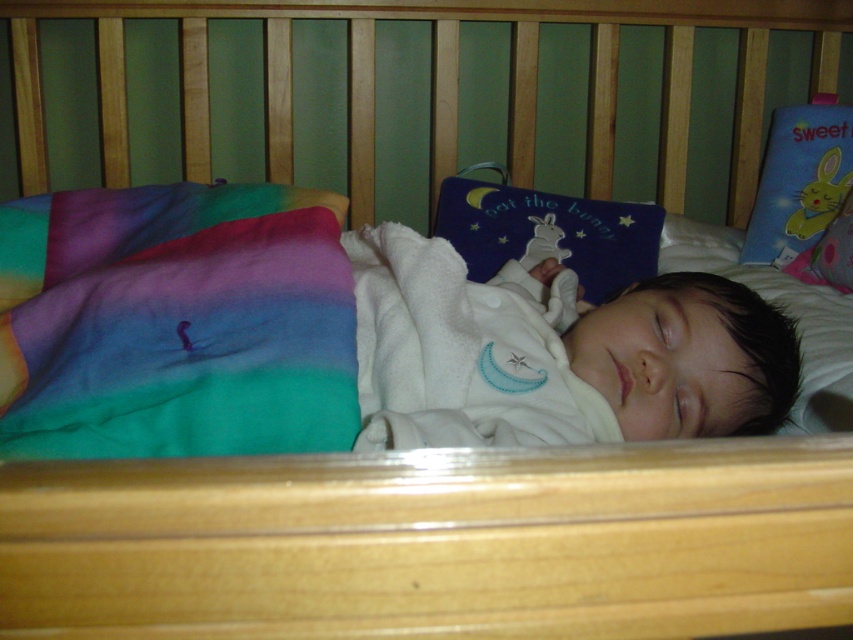
Who is more distant from viewer, (537, 230) or (773, 224)?

The point (773, 224) is behind.

Is blue fabric book at center to the left of blue fabric pillow at upper right from the viewer's perspective?

Correct, you'll find blue fabric book at center to the left of blue fabric pillow at upper right.

Identify the location of blue fabric book at center. (549, 234).

The height and width of the screenshot is (640, 853). What are the coordinates of `blue fabric book at center` in the screenshot? It's located at (549, 234).

Does white soft baby at center have a lesser width compared to blue fabric book at center?

Incorrect, white soft baby at center's width is not less than blue fabric book at center's.

Locate an element on the screen. This screenshot has width=853, height=640. white soft baby at center is located at coordinates (555, 353).

What are the coordinates of `white soft baby at center` in the screenshot? It's located at (555, 353).

Is multicolor fleece blanket at lower left to the right of blue fabric book at center from the viewer's perspective?

In fact, multicolor fleece blanket at lower left is to the left of blue fabric book at center.

From the picture: How distant is multicolor fleece blanket at lower left from blue fabric book at center?

They are 21.17 inches apart.

Between point (349, 316) and point (538, 256), which one is positioned in front?

Point (349, 316) is in front.

The width and height of the screenshot is (853, 640). In order to click on multicolor fleece blanket at lower left in this screenshot , I will do `click(183, 326)`.